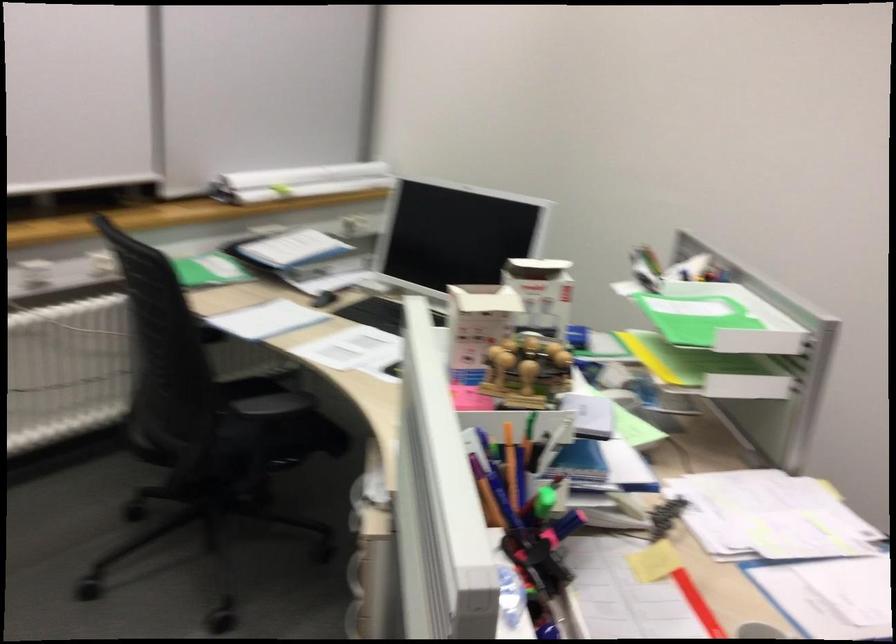
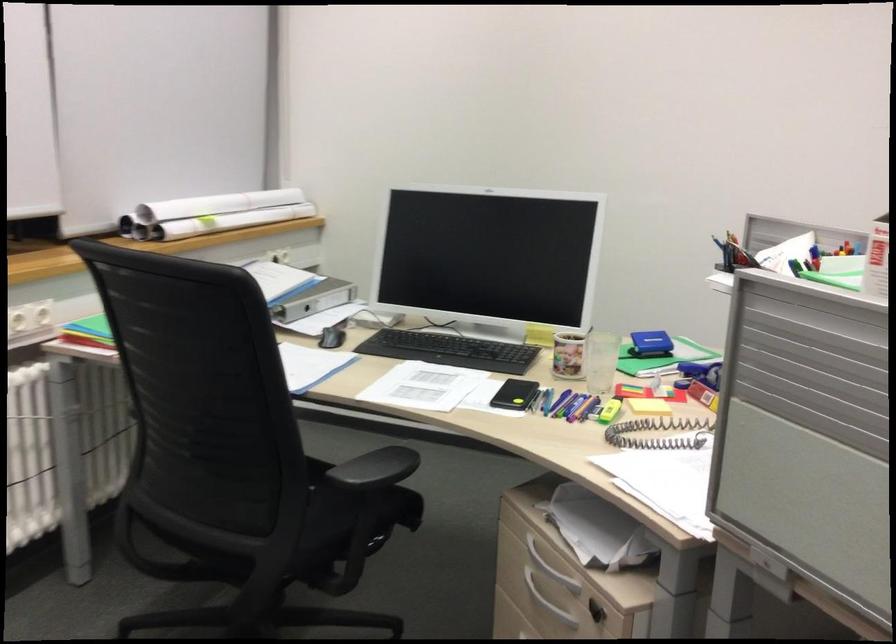
Where in the second image is the point corresponding to the point at 295,184 from the first image?

(212, 214)